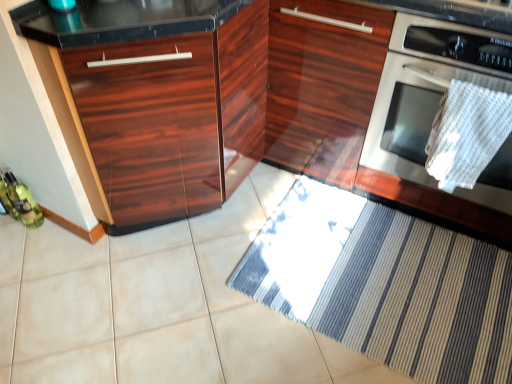
Question: Is white woven towel at right to the left or to the right of stainless steel oven at right in the image?

Choices:
 (A) left
 (B) right

Answer: (A)

Question: In terms of width, does white woven towel at right look wider or thinner when compared to stainless steel oven at right?

Choices:
 (A) wide
 (B) thin

Answer: (B)

Question: Which object is the farthest from the striped fabric doormat at lower center?

Choices:
 (A) glossy wood cabinet at center, the 2th cabinetry in the left-to-right sequence
 (B) stainless steel oven at right
 (C) glossy wood cabinet at left, which ranks as the second cabinetry in right-to-left order
 (D) white woven towel at right
 (E) green glass bottle at lower left

Answer: (E)

Question: Which is nearer to the glossy wood cabinet at left, marked as the 1th cabinetry in a left-to-right arrangement?

Choices:
 (A) glossy wood cabinet at center, the 2th cabinetry in the left-to-right sequence
 (B) white woven towel at right
 (C) green glass bottle at lower left
 (D) stainless steel oven at right
 (E) striped fabric doormat at lower center

Answer: (A)